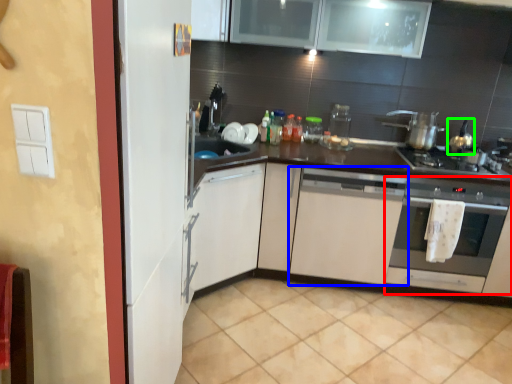
Question: Estimate the real-world distances between objects in this image. Which object is farther from oven (highlighted by a red box), cabinetry (highlighted by a blue box) or tea pot (highlighted by a green box)?

Choices:
 (A) cabinetry
 (B) tea pot

Answer: (B)